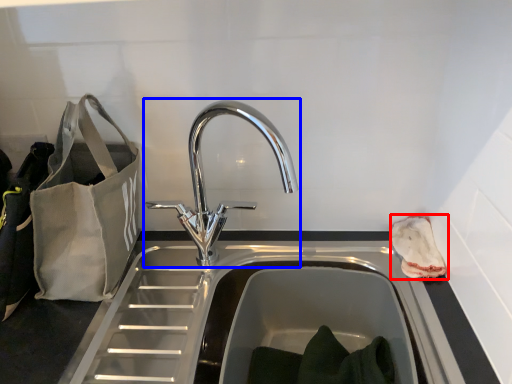
Question: Among these objects, which one is farthest to the camera, pouch (highlighted by a red box) or tap (highlighted by a blue box)?

Choices:
 (A) pouch
 (B) tap

Answer: (A)